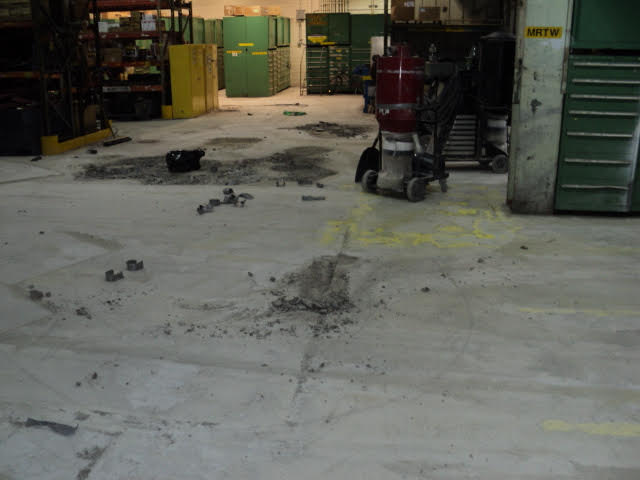
Locate an element on the screen. broom is located at coordinates (115, 138).